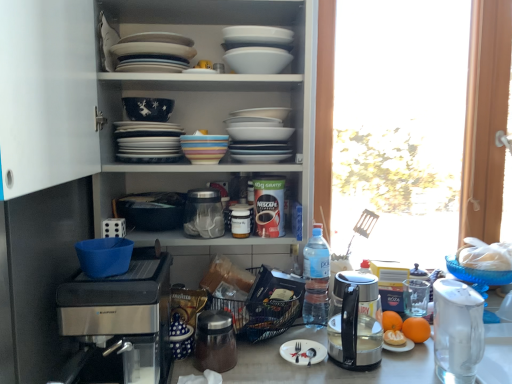
Question: Is transparent plastic jar at center wider or thinner than white matte paper plate at center?

Choices:
 (A) thin
 (B) wide

Answer: (B)

Question: Is transparent plastic jar at center bigger or smaller than white matte paper plate at center?

Choices:
 (A) small
 (B) big

Answer: (B)

Question: Estimate the real-world distances between objects in this image. Which object is farther from the transparent plastic jar at center?

Choices:
 (A) sleek stainless steel kettle at right
 (B) matte blue bowl at upper center, which appears as the 2th bowl when ordered from the bottom
 (C) white glossy plates at center, which appears as the third tableware when viewed from the right
 (D) blue plastic bowl at lower left, which is the first bowl in front-to-back order
 (E) satin silver coffee maker at lower left

Answer: (A)

Question: Which object is positioned farthest from the white glossy bowl at upper center, positioned as the 3th bowl in bottom-to-top order?

Choices:
 (A) white glossy kettle at right, placed as the third tableware when sorted from left to right
 (B) white matte paper plate at center
 (C) white glossy platter at upper center
 (D) clear plastic bottle at center-right
 (E) satin silver coffee maker at lower left

Answer: (A)